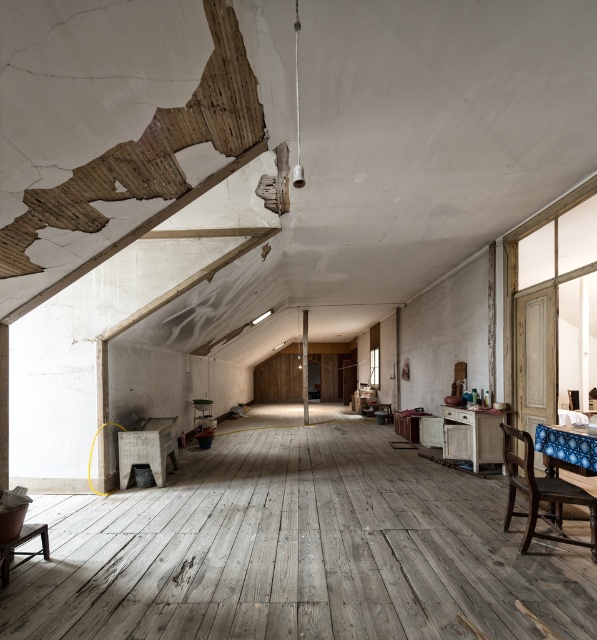
Can you confirm if dark wood chair at lower right is wider than wooden stool at center?

Yes.

Who is taller, dark wood chair at lower right or wooden stool at center?

dark wood chair at lower right is taller.

Between point (592, 512) and point (204, 406), which one is positioned in front?

Point (592, 512)

In order to click on dark wood chair at lower right in this screenshot , I will do `click(541, 493)`.

Is dark wood chair at lower right shorter than wooden beam at center?

Incorrect, dark wood chair at lower right's height does not fall short of wooden beam at center's.

Can you confirm if dark wood chair at lower right is smaller than wooden beam at center?

Incorrect, dark wood chair at lower right is not smaller in size than wooden beam at center.

This screenshot has height=640, width=597. What do you see at coordinates (541, 493) in the screenshot? I see `dark wood chair at lower right` at bounding box center [541, 493].

The width and height of the screenshot is (597, 640). I want to click on dark wood chair at lower right, so click(541, 493).

Between wooden beam at center and wooden stool at center, which one appears on the right side from the viewer's perspective?

From the viewer's perspective, wooden beam at center appears more on the right side.

Is point (306, 396) farther from camera compared to point (207, 404)?

Yes.

Who is more forward, (306, 333) or (201, 417)?

Positioned in front is point (201, 417).

What are the coordinates of `wooden beam at center` in the screenshot? It's located at (304, 368).